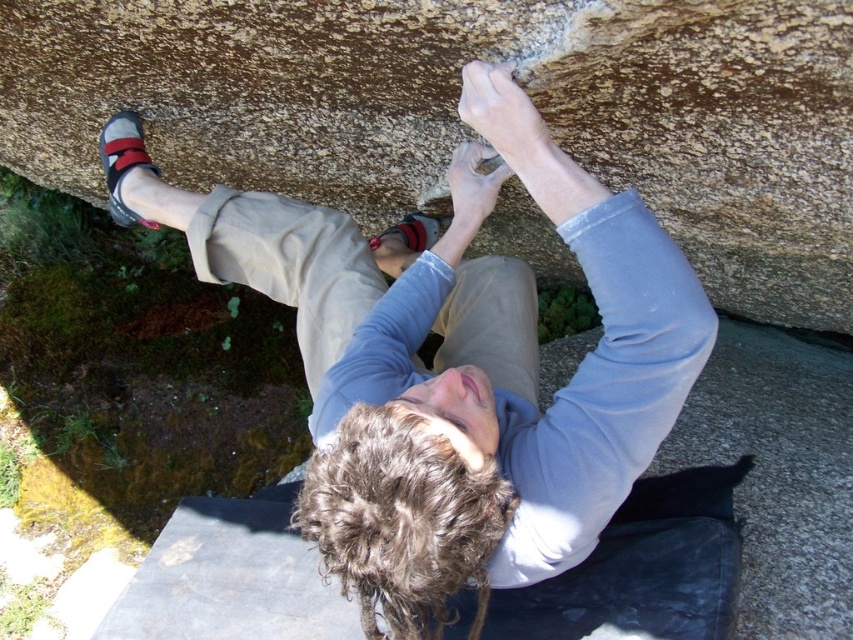
Question: Does brown rough rock at upper center appear on the left side of matte gray climbing shoe at upper left?

Choices:
 (A) no
 (B) yes

Answer: (A)

Question: Which point is farther from the camera taking this photo?

Choices:
 (A) (761, 67)
 (B) (700, 317)

Answer: (A)

Question: Does brown rough rock at upper center appear under matte gray climbing shoe at upper left?

Choices:
 (A) no
 (B) yes

Answer: (A)

Question: Which of the following is the farthest from the observer?

Choices:
 (A) (625, 200)
 (B) (740, 65)

Answer: (B)

Question: Can you confirm if brown rough rock at upper center is positioned below matte gray climbing shoe at upper left?

Choices:
 (A) no
 (B) yes

Answer: (A)